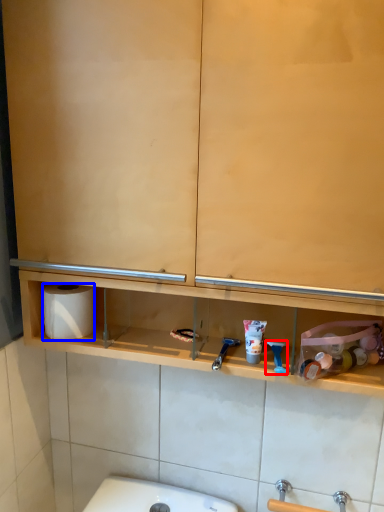
Question: Which of the following is the closest to the observer, shower (highlighted by a red box) or toilet paper (highlighted by a blue box)?

Choices:
 (A) shower
 (B) toilet paper

Answer: (A)